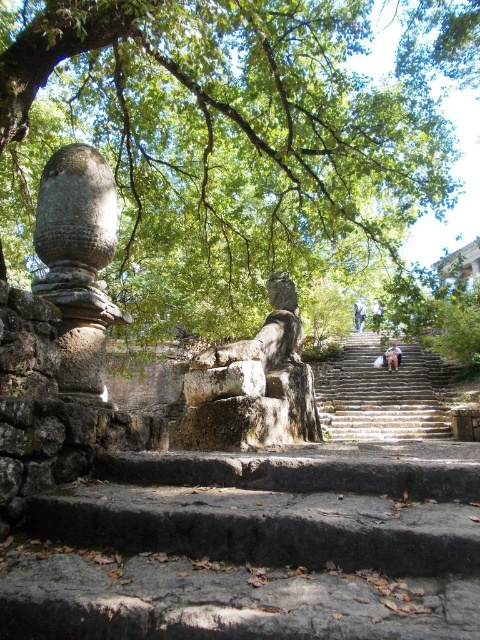
You are standing at the bottom of the stone staircase and want to take a photo of the green leafy tree at upper center and the stone textured stairs at center. Which object will appear larger in your photo?

The green leafy tree at upper center will appear larger in the photo because it is bigger than the stone textured stairs at center.